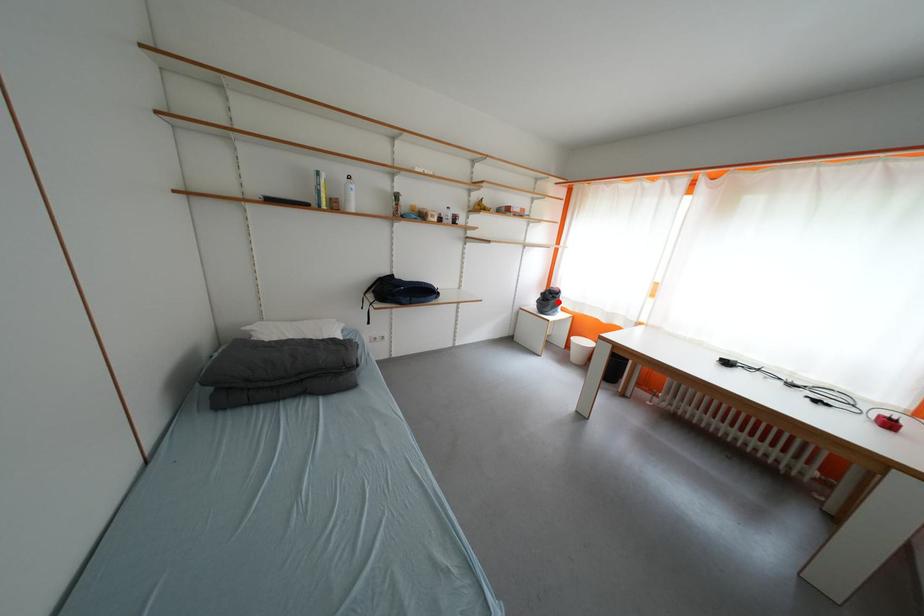
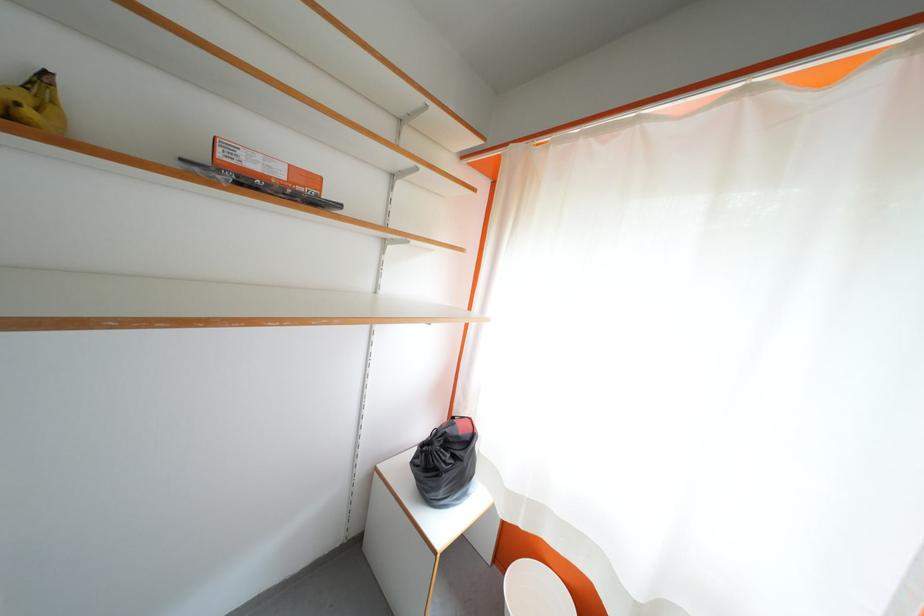
Question: I am providing you with two images of the same scene from different viewpoints. A red point is shown in image1. For the corresponding object point in image2, is it positioned nearer or farther from the camera?

Choices:
 (A) Nearer
 (B) Farther

Answer: (B)